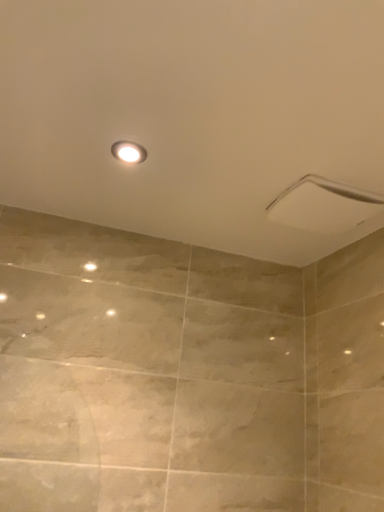
Question: From the image's perspective, is white glossy shower head at upper right positioned above or below white glossy light fixture at upper center?

Choices:
 (A) below
 (B) above

Answer: (A)

Question: Is white glossy shower head at upper right spatially inside white glossy light fixture at upper center, or outside of it?

Choices:
 (A) inside
 (B) outside

Answer: (B)

Question: Looking at their shapes, would you say white glossy shower head at upper right is wider or thinner than white glossy light fixture at upper center?

Choices:
 (A) wide
 (B) thin

Answer: (A)

Question: Considering the positions of white glossy light fixture at upper center and white glossy shower head at upper right in the image, is white glossy light fixture at upper center bigger or smaller than white glossy shower head at upper right?

Choices:
 (A) big
 (B) small

Answer: (B)

Question: Looking at their shapes, would you say white glossy light fixture at upper center is wider or thinner than white glossy shower head at upper right?

Choices:
 (A) wide
 (B) thin

Answer: (B)

Question: From a real-world perspective, is white glossy light fixture at upper center positioned above or below white glossy shower head at upper right?

Choices:
 (A) above
 (B) below

Answer: (A)

Question: Relative to white glossy shower head at upper right, is white glossy light fixture at upper center in front or behind?

Choices:
 (A) behind
 (B) front

Answer: (B)